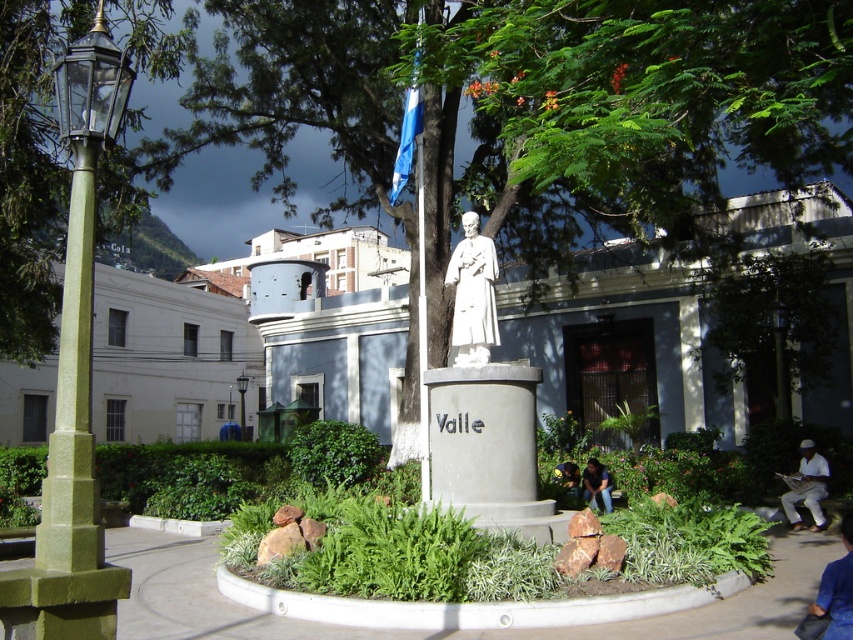
Is white marble statue at center thinner than blue fabric pants at lower right?

Indeed, white marble statue at center has a lesser width compared to blue fabric pants at lower right.

What do you see at coordinates (473, 294) in the screenshot? I see `white marble statue at center` at bounding box center [473, 294].

Who is more forward, (490, 326) or (825, 580)?

Point (825, 580)

Find the location of a particular element. This screenshot has height=640, width=853. white marble statue at center is located at coordinates (473, 294).

Which is above, green fabric bag at lower center or green painted metal streetlamp at center-left?

Positioned higher is green painted metal streetlamp at center-left.

Who is lower down, green fabric bag at lower center or green painted metal streetlamp at center-left?

green fabric bag at lower center is below.

Is point (575, 499) closer to camera compared to point (236, 380)?

Yes, point (575, 499) is closer to viewer.

Locate an element on the screen. green fabric bag at lower center is located at coordinates (566, 484).

Measure the distance between gray concrete pillar at center and green polished stone pole at left.

5.50 meters

Is gray concrete pillar at center wider than green polished stone pole at left?

No, gray concrete pillar at center is not wider than green polished stone pole at left.

Where is `gray concrete pillar at center`? The image size is (853, 640). gray concrete pillar at center is located at coordinates (488, 448).